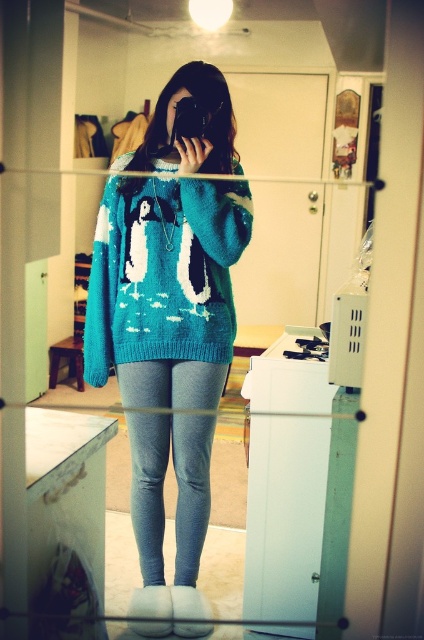
Question: Considering the relative positions of turquoise knitted sweater at center and gray knit leggings at center in the image provided, where is turquoise knitted sweater at center located with respect to gray knit leggings at center?

Choices:
 (A) above
 (B) below

Answer: (A)

Question: Which of the following is the farthest from the observer?

Choices:
 (A) (158, 525)
 (B) (103, 321)
 (C) (200, 424)

Answer: (A)

Question: Which of the following is the closest to the observer?

Choices:
 (A) teal knitted sweater at center
 (B) turquoise knitted sweater at center
 (C) gray knit leggings at center

Answer: (A)

Question: Which point is farther to the camera?

Choices:
 (A) turquoise knitted sweater at center
 (B) teal knitted sweater at center
 (C) gray knit leggings at center

Answer: (C)

Question: Is teal knitted sweater at center bigger than gray knit leggings at center?

Choices:
 (A) yes
 (B) no

Answer: (A)

Question: Can you confirm if turquoise knitted sweater at center is wider than teal knitted sweater at center?

Choices:
 (A) yes
 (B) no

Answer: (B)